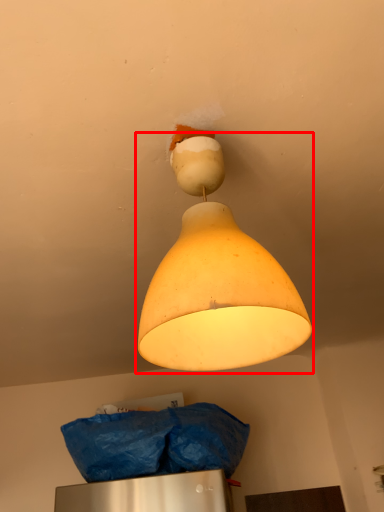
Question: From the image's perspective, what is the correct spatial relationship of lamp (annotated by the red box) in relation to material?

Choices:
 (A) below
 (B) above

Answer: (B)